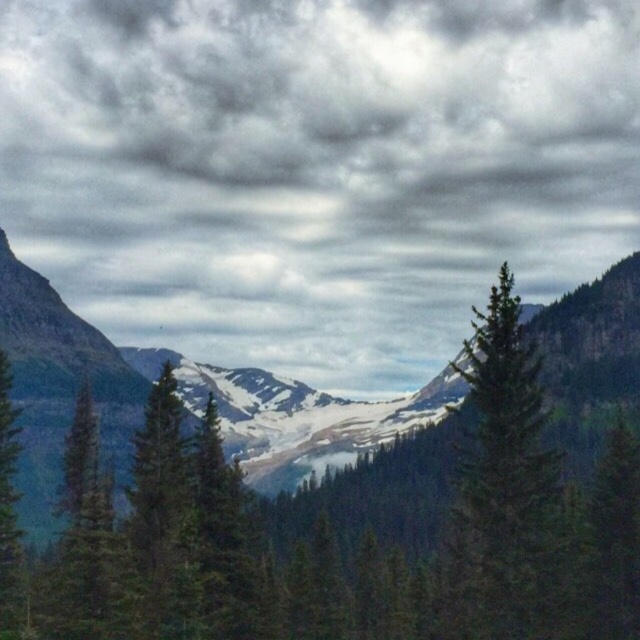
Based on the photo, you are an artist sketching this landscape. You want to draw the cloudy sky at upper center and the green matte tree at left. According to the scene, which object should you draw first to follow proper layering technique?

You should draw the green matte tree at left first because the cloudy sky at upper center is to the right of it, meaning the tree is in front and needs to be sketched before the sky background.

You are an artist planning to paint the cloudy sky at upper center and the green matte tree at left. Which of these two elements should you paint first if you follow the standard painting technique of starting with the largest elements?

The cloudy sky at upper center should be painted first because it has a larger size compared to the green matte tree at left.

You are a hiker looking at the green matte tree at center and the green matte tree at left. Which tree is closer to you?

The green matte tree at center is closer to you because it is in front of the green matte tree at left.